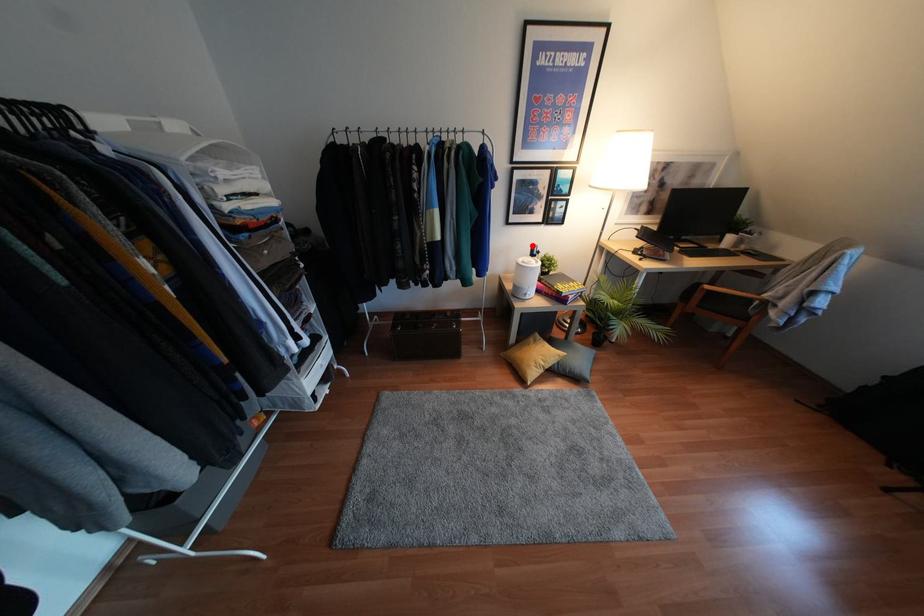
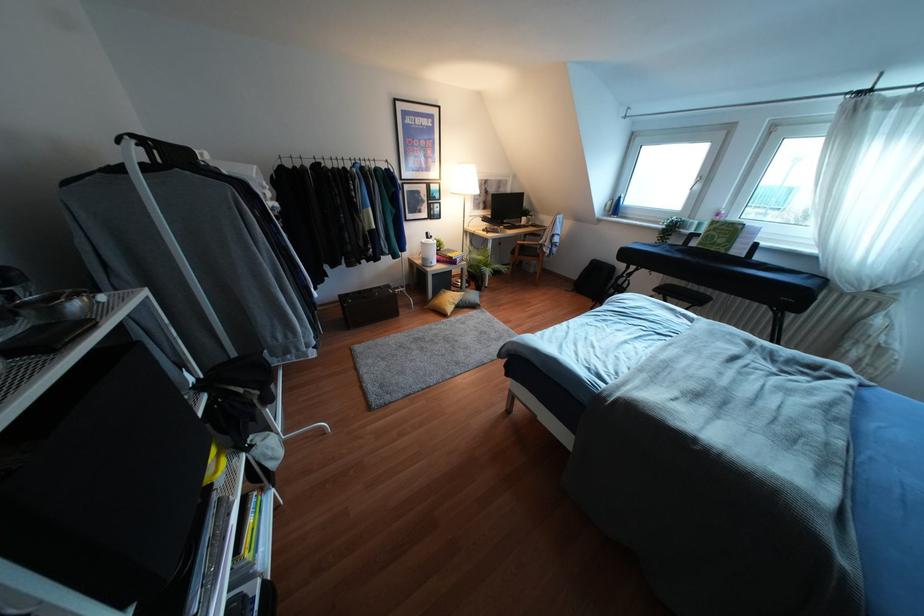
Question: I am providing you with two images of the same scene from different viewpoints. In image1, a red point is highlighted. Considering the same 3D point in image2, which of the following is correct?

Choices:
 (A) It is closer
 (B) It is farther

Answer: (A)